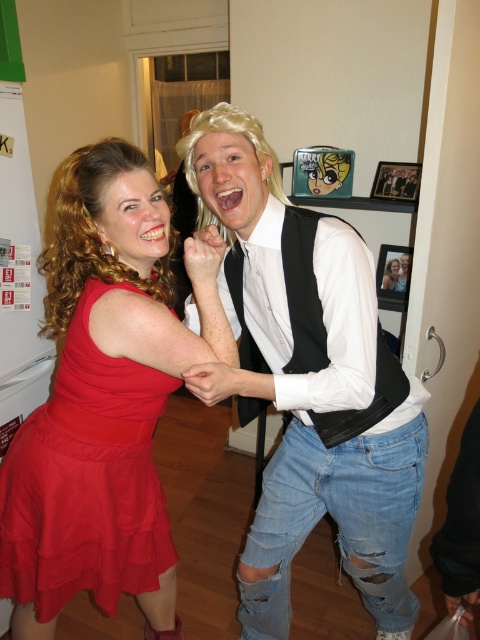
Question: Which of the following is the closest to the observer?

Choices:
 (A) (45, 486)
 (B) (265, 474)

Answer: (A)

Question: Does white matte vest at center appear on the right side of red chiffon skirt at left?

Choices:
 (A) no
 (B) yes

Answer: (B)

Question: Which point appears closest to the camera in this image?

Choices:
 (A) (80, 310)
 (B) (289, 438)

Answer: (A)

Question: Is white matte vest at center to the right of red chiffon skirt at left from the viewer's perspective?

Choices:
 (A) yes
 (B) no

Answer: (A)

Question: Among these points, which one is nearest to the camera?

Choices:
 (A) (132, 563)
 (B) (385, 616)

Answer: (A)

Question: In this image, where is white matte vest at center located relative to red chiffon skirt at left?

Choices:
 (A) right
 (B) left

Answer: (A)